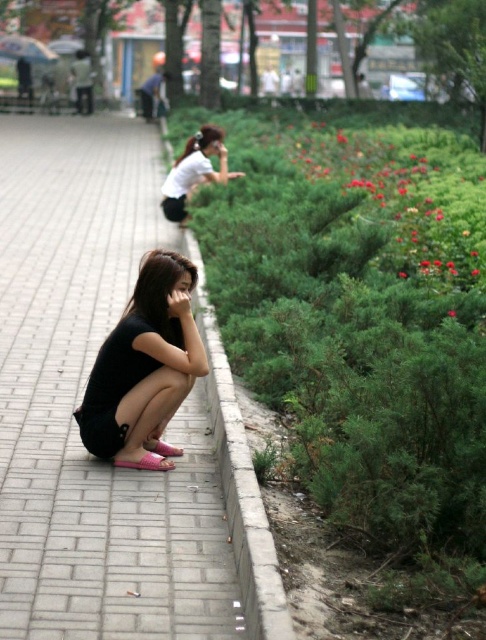
Is red matte flowers at upper right positioned in front of gray concrete curb at lower center?

No.

Which is in front, point (440, 220) or point (235, 508)?

Positioned in front is point (235, 508).

The image size is (486, 640). I want to click on red matte flowers at upper right, so [410, 192].

Describe the element at coordinates (144, 369) in the screenshot. I see `black matte dress at lower left` at that location.

Measure the distance between black matte dress at lower left and gray concrete curb at lower center.

black matte dress at lower left is 28.37 inches away from gray concrete curb at lower center.

Between point (186, 372) and point (262, 600), which one is positioned behind?

The point (186, 372) is more distant.

At what (x,y) coordinates should I click in order to perform the action: click on black matte dress at lower left. Please return your answer as a coordinate pair (x, y). This screenshot has height=640, width=486. Looking at the image, I should click on (144, 369).

From the picture: Is black matte dress at lower left wider than white matte shirt at upper center?

No.

Is black matte dress at lower left below white matte shirt at upper center?

Indeed, black matte dress at lower left is positioned under white matte shirt at upper center.

Does point (149, 358) come in front of point (208, 144)?

That is True.

Find the location of a particular element. This screenshot has width=486, height=640. black matte dress at lower left is located at coordinates (144, 369).